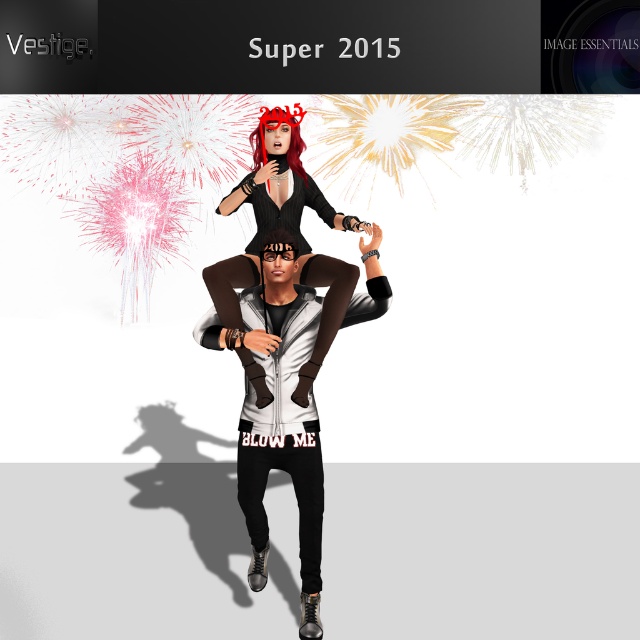
Question: Can you confirm if white matte jacket at center is positioned above matte black dress at center?

Choices:
 (A) no
 (B) yes

Answer: (A)

Question: Can you confirm if white matte jacket at center is bigger than matte black dress at center?

Choices:
 (A) yes
 (B) no

Answer: (A)

Question: Is white matte jacket at center smaller than matte black dress at center?

Choices:
 (A) yes
 (B) no

Answer: (B)

Question: Which point is farther to the camera?

Choices:
 (A) (218, 273)
 (B) (300, 532)

Answer: (A)

Question: Which object is farther from the camera taking this photo?

Choices:
 (A) matte black dress at center
 (B) white matte jacket at center

Answer: (A)

Question: Which of the following is the farthest from the observer?

Choices:
 (A) white matte jacket at center
 (B) matte black dress at center

Answer: (B)